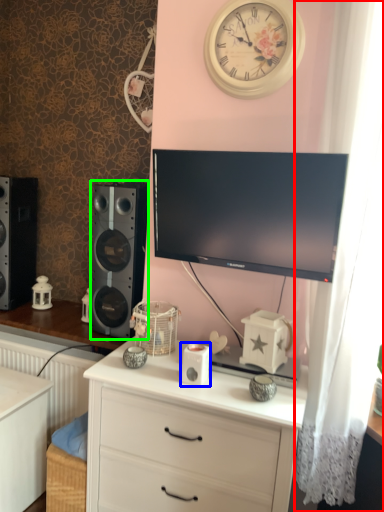
Question: Which object is the farthest from curtain (highlighted by a red box)? Choose among these: ipod (highlighted by a blue box) or speaker (highlighted by a green box).

Choices:
 (A) ipod
 (B) speaker

Answer: (B)